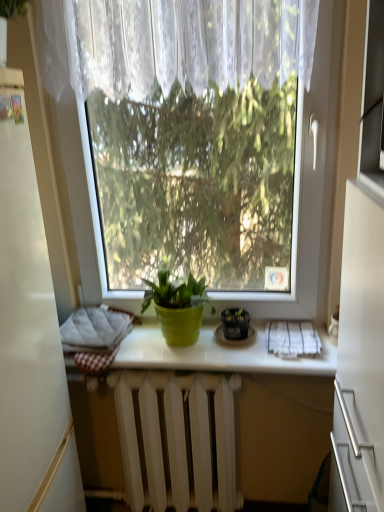
Where is `empty space that is ontop of white painted metal radiator at center (from a real-world perspective)`? The width and height of the screenshot is (384, 512). empty space that is ontop of white painted metal radiator at center (from a real-world perspective) is located at coordinates (185, 375).